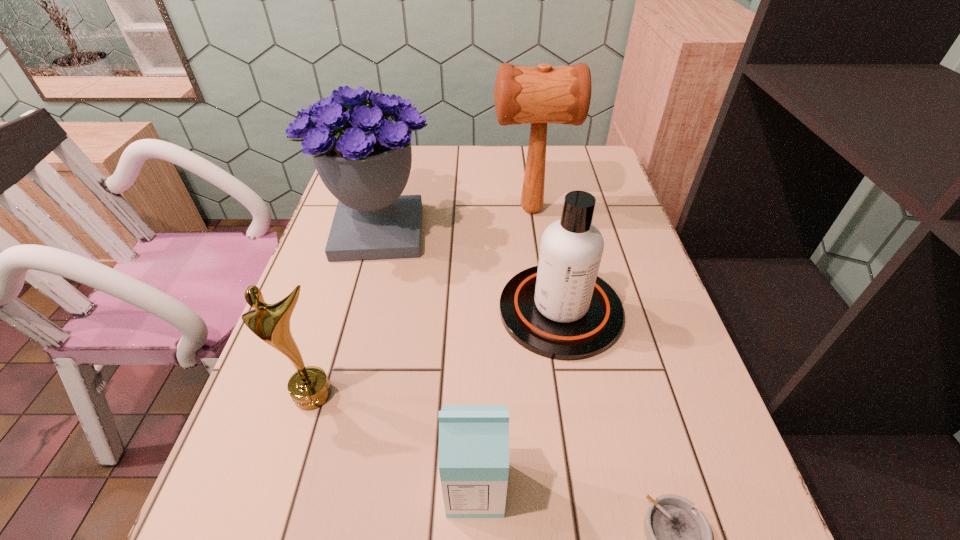
The image size is (960, 540). Identify the location of mallet. (539, 95).

You are a GUI agent. You are given a task and a screenshot of the screen. Output one action in this format:
    pyautogui.click(x=<x>, y=<y>)
    Task: Click on the bouquet
    
    Given the screenshot: What is the action you would take?
    pyautogui.click(x=363, y=155)

Image resolution: width=960 pixels, height=540 pixels. Find the location of `cleansing agent`. cleansing agent is located at coordinates (560, 309).

You are a GUI agent. You are given a task and a screenshot of the screen. Output one action in this format:
    pyautogui.click(x=<x>, y=<y>)
    Task: Click on the fourth farthest object
    Image resolution: width=960 pixels, height=540 pixels.
    Given the screenshot: What is the action you would take?
    pyautogui.click(x=309, y=387)

Locate an element on the screen. The image size is (960, 540). milk carton is located at coordinates (473, 439).

Find the location of a particular element. Image resolution: width=960 pixels, height=540 pixels. free space located on the strike surface of the mallet is located at coordinates (422, 210).

This screenshot has width=960, height=540. What are the coordinates of `free space located on the strike surface of the mallet` in the screenshot? It's located at (450, 210).

Where is `free space located on the strike surface of the mallet`? Image resolution: width=960 pixels, height=540 pixels. free space located on the strike surface of the mallet is located at coordinates (454, 210).

The image size is (960, 540). Identify the location of free spot located 0.250m on the front of the bouquet. [348, 353].

Find the location of a particular element. This screenshot has height=540, width=960. free space located on the back of the cleansing agent is located at coordinates (549, 248).